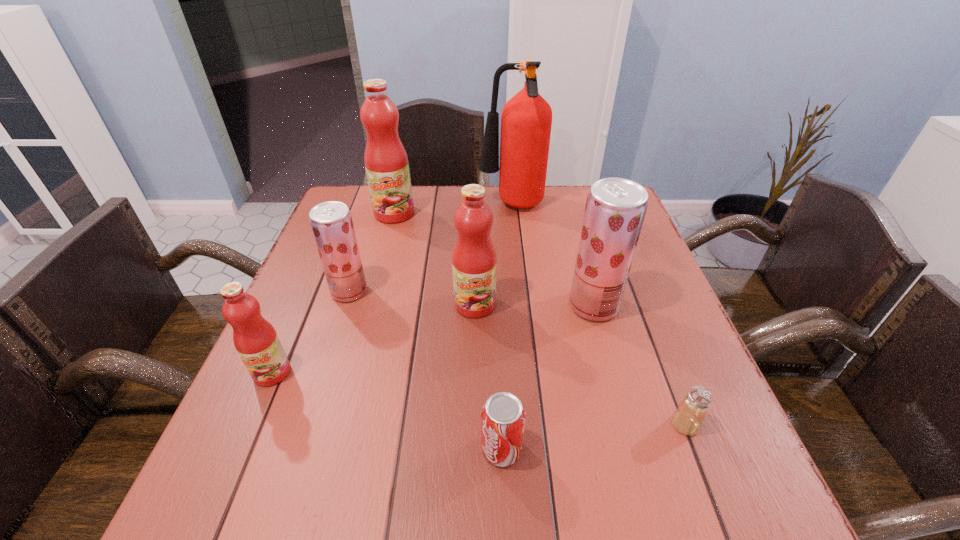
Where is `red fire extinguisher`? red fire extinguisher is located at coordinates (526, 120).

Where is `the biggest pink fruit juice`? Image resolution: width=960 pixels, height=540 pixels. the biggest pink fruit juice is located at coordinates (386, 162).

Identify the location of the tallest fruit juice. This screenshot has height=540, width=960. (386, 162).

The width and height of the screenshot is (960, 540). I want to click on the second biggest pink fruit juice, so click(474, 262).

You are a GUI agent. You are given a task and a screenshot of the screen. Output one action in this format:
    pyautogui.click(x=<x>, y=<y>)
    Task: Click on the second fruit juice from right to left
    The width and height of the screenshot is (960, 540).
    Given the screenshot: What is the action you would take?
    pyautogui.click(x=474, y=262)

Where is `the bigger strawberry fruit juice`? This screenshot has width=960, height=540. the bigger strawberry fruit juice is located at coordinates (615, 209).

Where is `the right strawberry fruit juice`? This screenshot has height=540, width=960. the right strawberry fruit juice is located at coordinates (615, 209).

Where is `the smaller strawberry fruit juice`? Image resolution: width=960 pixels, height=540 pixels. the smaller strawberry fruit juice is located at coordinates [x=331, y=222].

Find the location of a particular element. The height and width of the screenshot is (540, 960). the leftmost fruit juice is located at coordinates (255, 339).

This screenshot has width=960, height=540. In order to click on the leftmost object in this screenshot , I will do `click(255, 339)`.